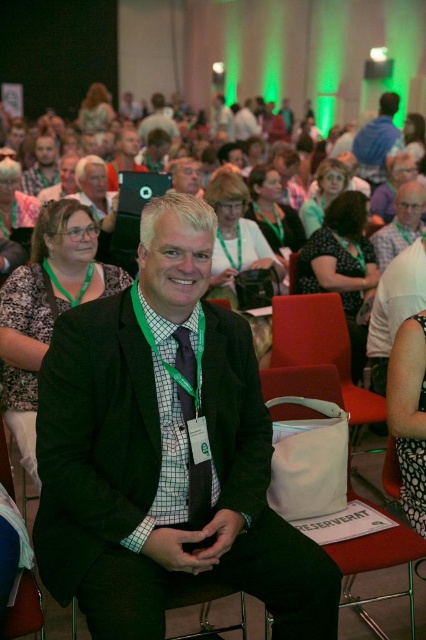
Is green woven tie at center shorter than matte black glasses at center?

Yes, green woven tie at center is shorter than matte black glasses at center.

Who is more forward, (198, 412) or (276, 214)?

Point (198, 412)

Based on the photo, who is more forward, (187, 432) or (271, 232)?

Point (187, 432)

At what (x,y) coordinates should I click in order to perform the action: click on green woven tie at center. Please return your answer as a coordinate pair (x, y). Looking at the image, I should click on (187, 433).

Is point (264, 264) less distant than point (339, 182)?

Yes, it is in front of point (339, 182).

Does matte black camera at center have a greater height compared to matte green lanyard at center?

Yes.

What are the coordinates of `matte black camera at center` in the screenshot? It's located at (235, 236).

Is black textured blazer at center taller than white fabric chair at lower center?

Indeed, black textured blazer at center has a greater height compared to white fabric chair at lower center.

Between black textured blazer at center and white fabric chair at lower center, which one has more height?

black textured blazer at center

Does point (37, 234) lie behind point (391, 541)?

Yes, point (37, 234) is farther from viewer.

In order to click on black textured blazer at center in this screenshot , I will do `click(46, 307)`.